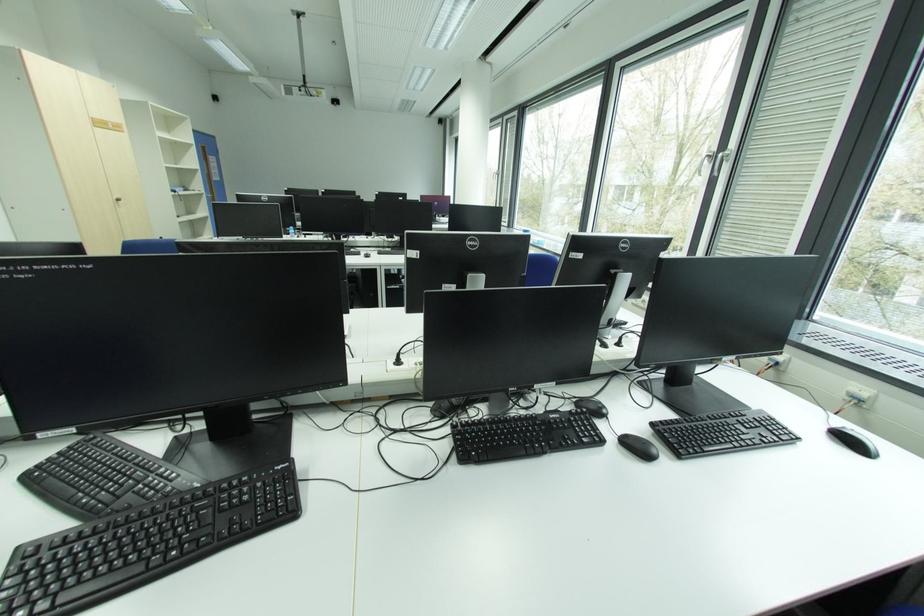
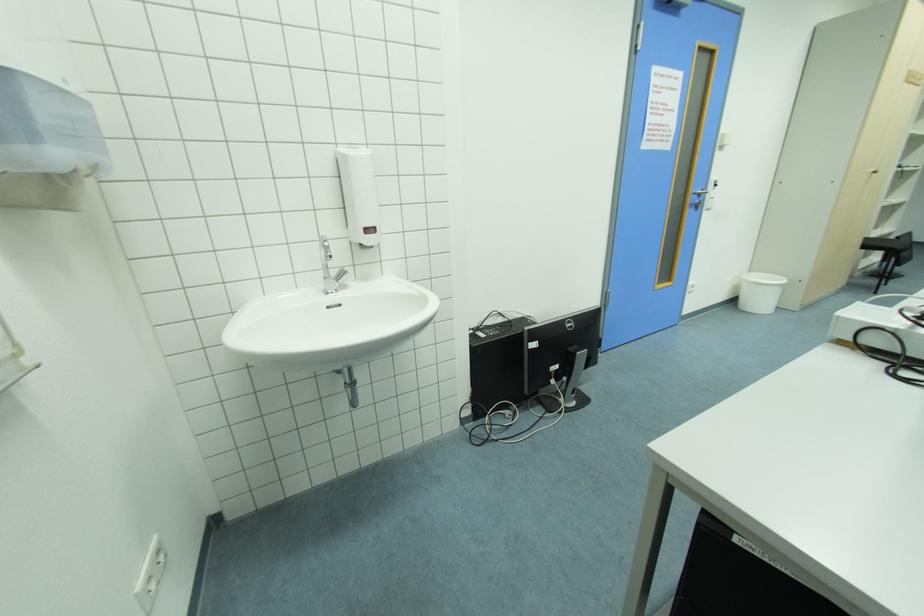
Where in the second image is the point corresponding to point (120, 199) from the first image?

(878, 172)